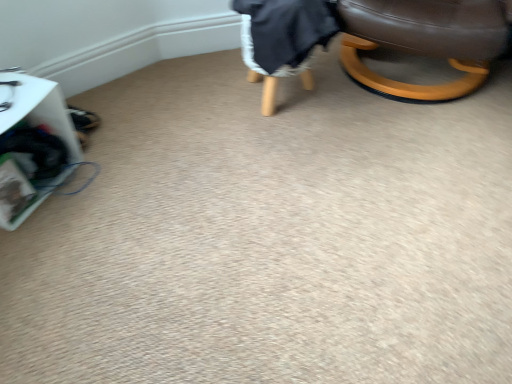
Question: Is brown leather chair at upper right facing towards dark gray fabric bean bag chair at upper right?

Choices:
 (A) no
 (B) yes

Answer: (A)

Question: Is brown leather chair at upper right further to the viewer compared to dark gray fabric bean bag chair at upper right?

Choices:
 (A) yes
 (B) no

Answer: (B)

Question: Can you confirm if brown leather chair at upper right is bigger than dark gray fabric bean bag chair at upper right?

Choices:
 (A) no
 (B) yes

Answer: (B)

Question: Are brown leather chair at upper right and dark gray fabric bean bag chair at upper right located far from each other?

Choices:
 (A) no
 (B) yes

Answer: (A)

Question: From the image's perspective, is brown leather chair at upper right below dark gray fabric bean bag chair at upper right?

Choices:
 (A) yes
 (B) no

Answer: (B)

Question: Would you say white plastic basket at left is to the left or to the right of brown leather chair at upper right in the picture?

Choices:
 (A) left
 (B) right

Answer: (A)

Question: Choose the correct answer: Is white plastic basket at left inside brown leather chair at upper right or outside it?

Choices:
 (A) outside
 (B) inside

Answer: (A)

Question: From a real-world perspective, relative to brown leather chair at upper right, is white plastic basket at left vertically above or below?

Choices:
 (A) below
 (B) above

Answer: (A)

Question: Considering the positions of white plastic basket at left and brown leather chair at upper right in the image, is white plastic basket at left taller or shorter than brown leather chair at upper right?

Choices:
 (A) tall
 (B) short

Answer: (B)

Question: From the image's perspective, is brown leather chair at upper right above or below dark gray fabric bean bag chair at upper right?

Choices:
 (A) above
 (B) below

Answer: (A)

Question: In terms of width, does brown leather chair at upper right look wider or thinner when compared to dark gray fabric bean bag chair at upper right?

Choices:
 (A) wide
 (B) thin

Answer: (A)

Question: Is brown leather chair at upper right spatially inside dark gray fabric bean bag chair at upper right, or outside of it?

Choices:
 (A) outside
 (B) inside

Answer: (A)

Question: Based on their sizes in the image, would you say brown leather chair at upper right is bigger or smaller than dark gray fabric bean bag chair at upper right?

Choices:
 (A) big
 (B) small

Answer: (A)

Question: Visually, is dark gray fabric bean bag chair at upper right positioned to the left or to the right of brown leather chair at upper right?

Choices:
 (A) right
 (B) left

Answer: (B)

Question: Does point (313, 11) appear closer or farther from the camera than point (498, 8)?

Choices:
 (A) closer
 (B) farther

Answer: (B)